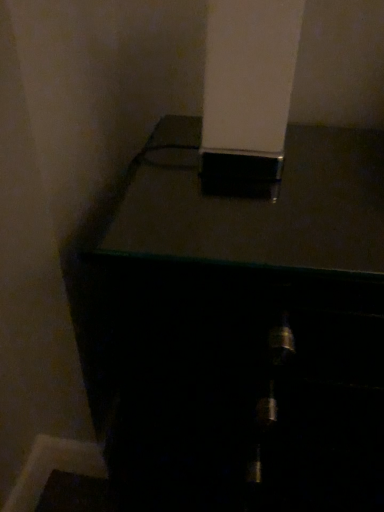
Question: Is white glossy pillar at upper center bigger than black glossy safe at upper center?

Choices:
 (A) yes
 (B) no

Answer: (B)

Question: Considering the relative sizes of white glossy pillar at upper center and black glossy safe at upper center in the image provided, is white glossy pillar at upper center thinner than black glossy safe at upper center?

Choices:
 (A) yes
 (B) no

Answer: (A)

Question: Is white glossy pillar at upper center to the left of black glossy safe at upper center from the viewer's perspective?

Choices:
 (A) yes
 (B) no

Answer: (A)

Question: Is white glossy pillar at upper center outside of black glossy safe at upper center?

Choices:
 (A) yes
 (B) no

Answer: (A)

Question: Is white glossy pillar at upper center far from black glossy safe at upper center?

Choices:
 (A) no
 (B) yes

Answer: (A)

Question: Is white glossy pillar at upper center to the right of black glossy safe at upper center from the viewer's perspective?

Choices:
 (A) no
 (B) yes

Answer: (A)

Question: Is white glossy pillar at upper center a part of black glossy safe at upper center?

Choices:
 (A) yes
 (B) no

Answer: (B)

Question: Is black glossy safe at upper center aimed at white glossy pillar at upper center?

Choices:
 (A) no
 (B) yes

Answer: (A)

Question: Is black glossy safe at upper center taller than white glossy pillar at upper center?

Choices:
 (A) no
 (B) yes

Answer: (B)

Question: Is black glossy safe at upper center not within white glossy pillar at upper center?

Choices:
 (A) no
 (B) yes

Answer: (B)

Question: Is black glossy safe at upper center at the right side of white glossy pillar at upper center?

Choices:
 (A) yes
 (B) no

Answer: (A)

Question: Does black glossy safe at upper center appear on the left side of white glossy pillar at upper center?

Choices:
 (A) yes
 (B) no

Answer: (B)

Question: Considering the positions of white glossy pillar at upper center and black glossy safe at upper center in the image, is white glossy pillar at upper center wider or thinner than black glossy safe at upper center?

Choices:
 (A) thin
 (B) wide

Answer: (A)